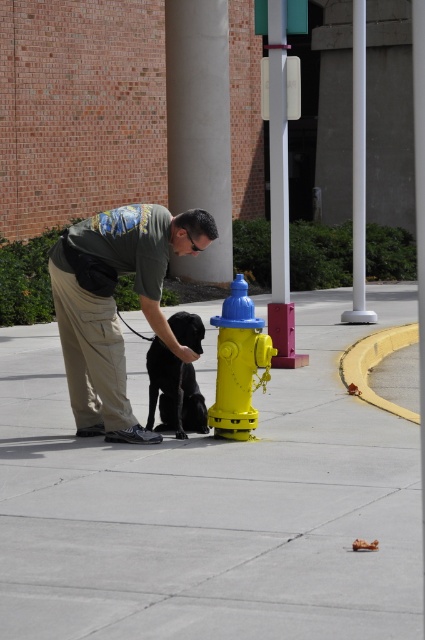
Question: Which object is the closest to the yellow matte hydrant at center?

Choices:
 (A) shiny black dog at center
 (B) khaki cargo pants at center

Answer: (A)

Question: Which object is the farthest from the khaki cargo pants at center?

Choices:
 (A) shiny black dog at center
 (B) yellow matte hydrant at center
 (C) smooth concrete sidewalk at center

Answer: (C)

Question: Does yellow matte hydrant at center have a larger size compared to shiny black dog at center?

Choices:
 (A) no
 (B) yes

Answer: (B)

Question: Is khaki cargo pants at center further to camera compared to shiny black dog at center?

Choices:
 (A) no
 (B) yes

Answer: (A)

Question: Which object appears closest to the camera in this image?

Choices:
 (A) yellow matte hydrant at center
 (B) smooth concrete sidewalk at center
 (C) khaki cargo pants at center
 (D) shiny black dog at center

Answer: (B)

Question: From the image, what is the correct spatial relationship of smooth concrete sidewalk at center in relation to yellow matte hydrant at center?

Choices:
 (A) above
 (B) below

Answer: (B)